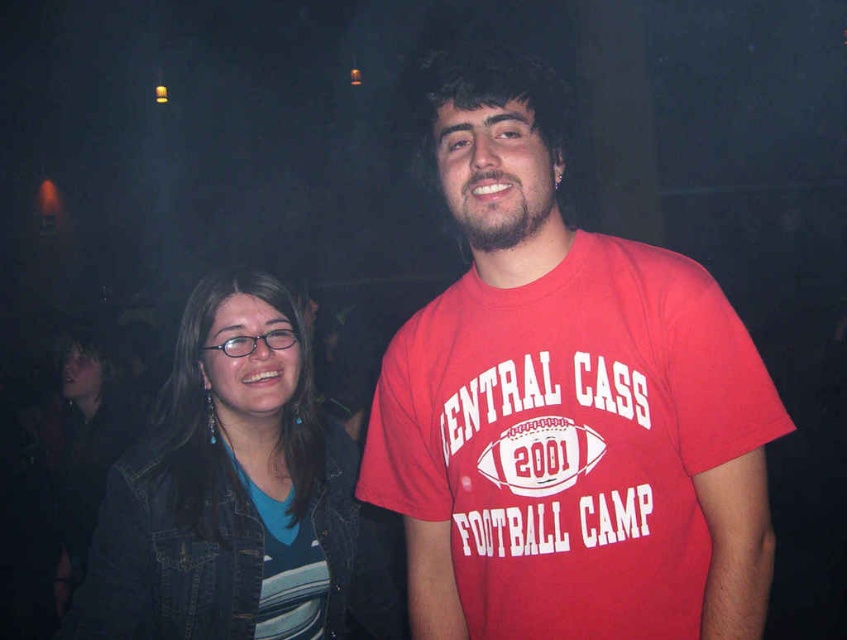
Does point (547, 140) come behind point (201, 496)?

No, it is not.

Which is above, red cotton t-shirt at center or blue denim jacket at lower left?

red cotton t-shirt at center is above.

Does point (612, 316) lie in front of point (283, 481)?

That is True.

You are a GUI agent. You are given a task and a screenshot of the screen. Output one action in this format:
    pyautogui.click(x=<x>, y=<y>)
    Task: Click on the red cotton t-shirt at center
    Image resolution: width=847 pixels, height=640 pixels.
    Given the screenshot: What is the action you would take?
    pyautogui.click(x=566, y=406)